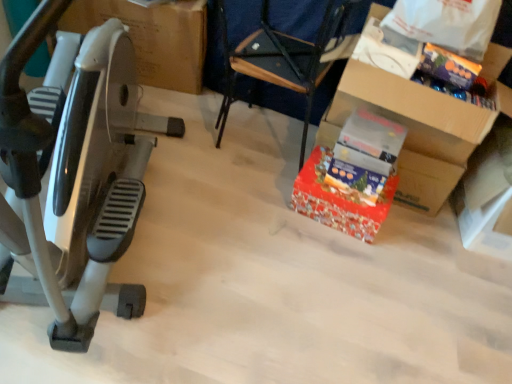
Image resolution: width=512 pixels, height=384 pixels. Identify the location of vacant space that is in between silver metallic stationary bicycle at left and white cardboard box at right. (294, 261).